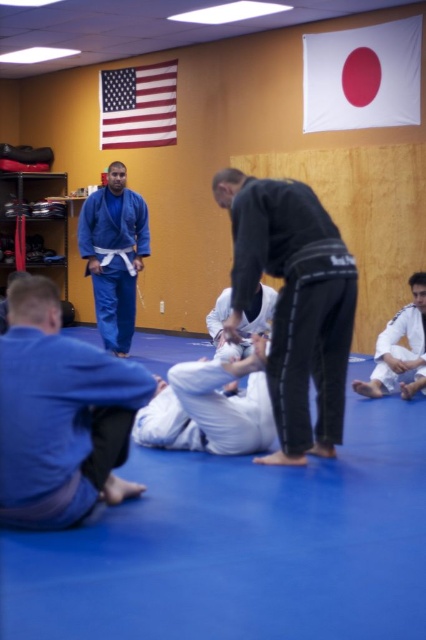
From the picture: Is black matte uniform at center above white fabric pants at center?

Yes, black matte uniform at center is above white fabric pants at center.

Is black matte uniform at center smaller than white fabric pants at center?

Actually, black matte uniform at center might be larger than white fabric pants at center.

Between point (271, 237) and point (187, 392), which one is positioned in front?

Positioned in front is point (271, 237).

I want to click on black matte uniform at center, so click(293, 304).

Consider the image. Which of these two, blue matte gi at lower left or black matte uniform at center, stands shorter?

blue matte gi at lower left

The height and width of the screenshot is (640, 426). I want to click on blue matte gi at lower left, so click(x=60, y=416).

Does white fabric pants at center appear under blue fabric gi at center?

Correct, white fabric pants at center is located below blue fabric gi at center.

Is white fabric pants at center above blue fabric gi at center?

No, white fabric pants at center is not above blue fabric gi at center.

Is point (215, 380) farther from camera compared to point (100, 332)?

No, it is not.

Image resolution: width=426 pixels, height=640 pixels. What are the coordinates of `white fabric pants at center` in the screenshot? It's located at (210, 408).